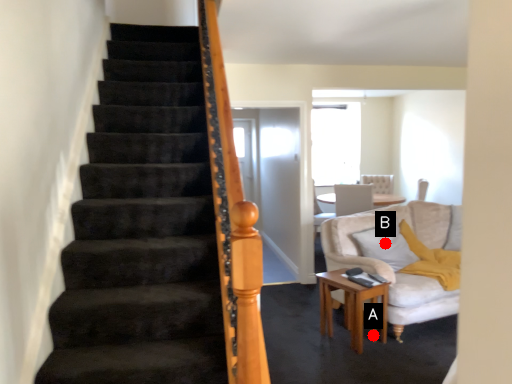
Question: Two points are circled on the image, labeled by A and B beside each circle. Which of the following is the farthest from the observer?

Choices:
 (A) A is further
 (B) B is further

Answer: (B)